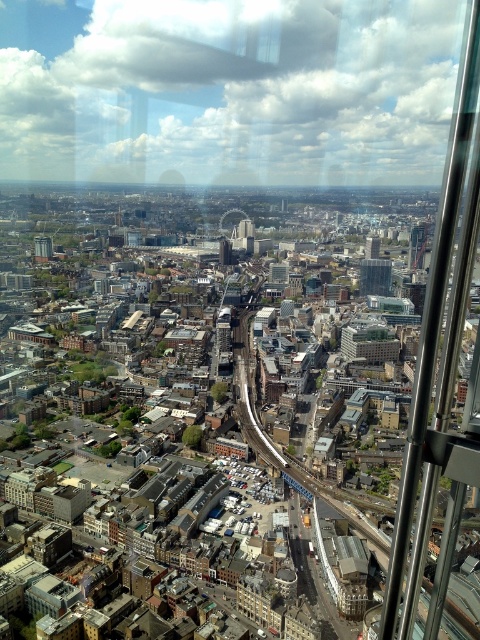
Question: Estimate the real-world distances between objects in this image. Which object is farther from the matte glass tower at center?

Choices:
 (A) glassy reflective skyscraper at center
 (B) matte gray tower at center

Answer: (B)

Question: Which object is positioned farthest from the glassy reflective skyscraper at center?

Choices:
 (A) matte gray tower at center
 (B) matte glass tower at center

Answer: (A)

Question: Can you confirm if glassy reflective skyscraper at center is wider than matte glass tower at center?

Choices:
 (A) no
 (B) yes

Answer: (B)

Question: Is glassy reflective skyscraper at center below matte glass tower at center?

Choices:
 (A) no
 (B) yes

Answer: (B)

Question: Among these points, which one is farthest from the camera?

Choices:
 (A) (380, 259)
 (B) (35, 253)

Answer: (B)

Question: Does glassy reflective skyscraper at center appear under matte glass tower at center?

Choices:
 (A) yes
 (B) no

Answer: (A)